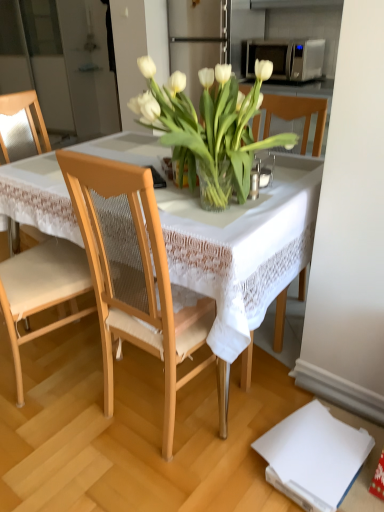
Measure the distance between white lace tablecloth at center and camera.

white lace tablecloth at center and camera are 3.61 feet apart from each other.

This screenshot has height=512, width=384. What do you see at coordinates (285, 58) in the screenshot?
I see `satin silver microwave at upper right` at bounding box center [285, 58].

The image size is (384, 512). Describe the element at coordinates (21, 127) in the screenshot. I see `light wood mesh chair at left, which ranks as the first chair in left-to-right order` at that location.

The width and height of the screenshot is (384, 512). I want to click on white lace tablecloth at center, so click(x=243, y=248).

Considering the positions of objects white lace tablecloth at center and satin silver microwave at upper right in the image provided, who is in front, white lace tablecloth at center or satin silver microwave at upper right?

white lace tablecloth at center is more forward.

Considering the positions of point (141, 154) and point (250, 54), is point (141, 154) closer or farther from the camera than point (250, 54)?

Clearly, point (141, 154) is closer to the camera than point (250, 54).

Is white lace tablecloth at center looking in the opposite direction of satin silver microwave at upper right?

No, white lace tablecloth at center is not facing the opposite direction of satin silver microwave at upper right.

Between white lace tablecloth at center and satin silver microwave at upper right, which one has larger width?

white lace tablecloth at center is wider.

Where is `chair above the white lace tablecloth at center (from the image's perspective)`? This screenshot has height=512, width=384. chair above the white lace tablecloth at center (from the image's perspective) is located at coordinates (21, 127).

From the image's perspective, is light wood mesh chair at left, which is counted as the second chair, starting from the right, positioned above or below white lace tablecloth at center?

light wood mesh chair at left, which is counted as the second chair, starting from the right, is above white lace tablecloth at center.

How distant is light wood mesh chair at left, acting as the 2th chair starting from the front, from white lace tablecloth at center?

The distance of light wood mesh chair at left, acting as the 2th chair starting from the front, from white lace tablecloth at center is 1.00 meters.

Consider the image. Considering the relative positions of light wood mesh chair at left, acting as the 2th chair starting from the front, and white lace tablecloth at center in the image provided, is light wood mesh chair at left, acting as the 2th chair starting from the front, to the left of white lace tablecloth at center from the viewer's perspective?

Indeed, light wood mesh chair at left, acting as the 2th chair starting from the front, is positioned on the left side of white lace tablecloth at center.

Between point (49, 149) and point (281, 59), which one is positioned in front?

The point (49, 149) is closer to the camera.

Who is taller, light wood mesh chair at left, acting as the 2th chair starting from the front, or satin silver microwave at upper right?

Standing taller between the two is light wood mesh chair at left, acting as the 2th chair starting from the front.

Is light wood mesh chair at left, acting as the 2th chair starting from the front, wider than satin silver microwave at upper right?

Yes, light wood mesh chair at left, acting as the 2th chair starting from the front, is wider than satin silver microwave at upper right.

Is light wood mesh chair at left, which is counted as the second chair, starting from the right, oriented towards satin silver microwave at upper right?

No, light wood mesh chair at left, which is counted as the second chair, starting from the right, does not turn towards satin silver microwave at upper right.

What's the angular difference between light wood mesh chair at left, acting as the 2th chair starting from the front, and translucent glass vase at center's facing directions?

176 degrees.

From the image's perspective, is light wood mesh chair at left, marked as the first chair in a back-to-front arrangement, located above translucent glass vase at center?

No, from the image's perspective, light wood mesh chair at left, marked as the first chair in a back-to-front arrangement, is not over translucent glass vase at center.

The width and height of the screenshot is (384, 512). What are the coordinates of `flower to the right of light wood mesh chair at left, which is counted as the second chair, starting from the right` in the screenshot? It's located at (209, 129).

Does point (41, 123) appear closer or farther from the camera than point (237, 84)?

Point (41, 123).

Considering the positions of point (151, 84) and point (156, 241), is point (151, 84) closer or farther from the camera than point (156, 241)?

Clearly, point (151, 84) is more distant from the camera than point (156, 241).

Based on their positions, is translucent glass vase at center located to the left or right of light wood chair at center, which ranks as the second chair in left-to-right order?

Clearly, translucent glass vase at center is on the right of light wood chair at center, which ranks as the second chair in left-to-right order, in the image.

Is translucent glass vase at center in front of light wood chair at center, which appears as the second chair when viewed from the back?

Yes.

Where is `flower above the light wood chair at center, which ranks as the second chair in left-to-right order (from the image's perspective)`? The width and height of the screenshot is (384, 512). flower above the light wood chair at center, which ranks as the second chair in left-to-right order (from the image's perspective) is located at coordinates (209, 129).

Would you say satin silver microwave at upper right is outside white lace tablecloth at center?

Indeed, satin silver microwave at upper right is completely outside white lace tablecloth at center.

Is satin silver microwave at upper right shorter than white lace tablecloth at center?

Yes, satin silver microwave at upper right is shorter than white lace tablecloth at center.

How much distance is there between satin silver microwave at upper right and white lace tablecloth at center?

satin silver microwave at upper right is 2.20 meters from white lace tablecloth at center.

How many degrees apart are the facing directions of light wood chair at center, positioned as the 1th chair in right-to-left order, and light wood mesh chair at left, marked as the first chair in a back-to-front arrangement?

There is a 91.5-degree angle between the facing directions of light wood chair at center, positioned as the 1th chair in right-to-left order, and light wood mesh chair at left, marked as the first chair in a back-to-front arrangement.

Considering the relative sizes of light wood chair at center, which appears as the second chair when viewed from the back, and light wood mesh chair at left, acting as the 2th chair starting from the front, in the image provided, is light wood chair at center, which appears as the second chair when viewed from the back, taller than light wood mesh chair at left, acting as the 2th chair starting from the front,?

Incorrect, the height of light wood chair at center, which appears as the second chair when viewed from the back, is not larger of that of light wood mesh chair at left, acting as the 2th chair starting from the front.

From the image's perspective, which is above, light wood chair at center, positioned as the 1th chair in right-to-left order, or light wood mesh chair at left, which ranks as the first chair in left-to-right order?

light wood mesh chair at left, which ranks as the first chair in left-to-right order, is shown above in the image.

Looking at their sizes, would you say light wood chair at center, which appears as the second chair when viewed from the back, is wider or thinner than light wood mesh chair at left, acting as the 2th chair starting from the front?

light wood chair at center, which appears as the second chair when viewed from the back, is thinner than light wood mesh chair at left, acting as the 2th chair starting from the front.

In the image, there is a white lace tablecloth at center. Where is `microwave oven above it (from the image's perspective)`? This screenshot has height=512, width=384. microwave oven above it (from the image's perspective) is located at coordinates click(x=285, y=58).

You are a GUI agent. You are given a task and a screenshot of the screen. Output one action in this format:
    pyautogui.click(x=<x>, y=<y>)
    Task: Click on the table in front of the light wood mesh chair at left, acting as the 2th chair starting from the front
    
    Given the screenshot: What is the action you would take?
    pyautogui.click(x=243, y=248)

Considering their positions, is light wood mesh chair at left, acting as the 2th chair starting from the front, positioned further to satin silver microwave at upper right than white lace tablecloth at center?

white lace tablecloth at center.

Based on their spatial positions, is satin silver microwave at upper right or light wood chair at center, which appears as the first chair when viewed from the front, further from translucent glass vase at center?

The object further to translucent glass vase at center is satin silver microwave at upper right.

Consider the image. Looking at the image, which one is located further to light wood mesh chair at left, marked as the first chair in a back-to-front arrangement, satin silver microwave at upper right or translucent glass vase at center?

satin silver microwave at upper right lies further to light wood mesh chair at left, marked as the first chair in a back-to-front arrangement, than the other object.

When comparing their distances from light wood chair at center, which appears as the first chair when viewed from the front, does white lace tablecloth at center or satin silver microwave at upper right seem further?

Among the two, satin silver microwave at upper right is located further to light wood chair at center, which appears as the first chair when viewed from the front.

From the picture: Looking at the image, which one is located closer to translucent glass vase at center, light wood chair at center, which appears as the second chair when viewed from the back, or white lace tablecloth at center?

white lace tablecloth at center lies closer to translucent glass vase at center than the other object.

Looking at this image, based on their spatial positions, is satin silver microwave at upper right or light wood chair at center, which appears as the second chair when viewed from the back, further from light wood mesh chair at left, which is counted as the second chair, starting from the right?

Among the two, satin silver microwave at upper right is located further to light wood mesh chair at left, which is counted as the second chair, starting from the right.

Estimate the real-world distances between objects in this image. Which object is closer to light wood mesh chair at left, marked as the first chair in a back-to-front arrangement, satin silver microwave at upper right or white lace tablecloth at center?

white lace tablecloth at center lies closer to light wood mesh chair at left, marked as the first chair in a back-to-front arrangement, than the other object.

Estimate the real-world distances between objects in this image. Which object is further from translucent glass vase at center, light wood chair at center, which appears as the first chair when viewed from the front, or light wood mesh chair at left, which is counted as the second chair, starting from the right?

light wood mesh chair at left, which is counted as the second chair, starting from the right, is positioned further to the anchor translucent glass vase at center.

The width and height of the screenshot is (384, 512). In order to click on table between light wood chair at center, which appears as the second chair when viewed from the back, and satin silver microwave at upper right from front to back in this screenshot , I will do `click(243, 248)`.

You are a GUI agent. You are given a task and a screenshot of the screen. Output one action in this format:
    pyautogui.click(x=<x>, y=<y>)
    Task: Click on the table between translucent glass vase at center and light wood mesh chair at left, which is counted as the second chair, starting from the right, from front to back
    This screenshot has width=384, height=512.
    Given the screenshot: What is the action you would take?
    pyautogui.click(x=243, y=248)

Locate an element on the screen. table between translucent glass vase at center and satin silver microwave at upper right in the front-back direction is located at coordinates (243, 248).

Locate an element on the screen. table between translucent glass vase at center and light wood chair at center, which ranks as the second chair in left-to-right order, vertically is located at coordinates (243, 248).